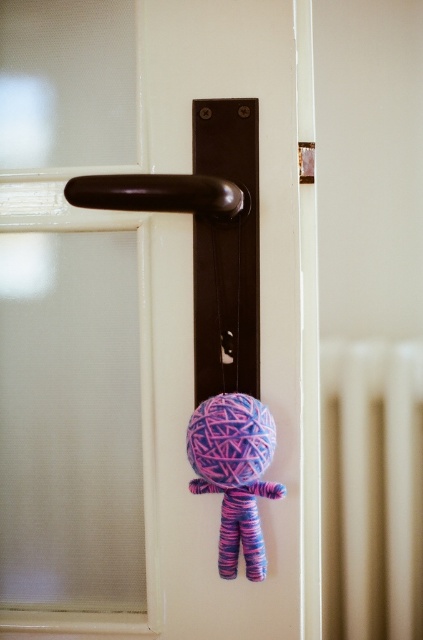
Which is in front, point (167, 60) or point (403, 621)?

Point (167, 60) is in front.

Measure the distance from matte brown handle at center to beige matte radiator at right.

matte brown handle at center is 19.74 inches away from beige matte radiator at right.

Between point (275, 72) and point (331, 529), which one is positioned behind?

Positioned behind is point (331, 529).

Image resolution: width=423 pixels, height=640 pixels. In order to click on matte brown handle at center in this screenshot , I will do `click(192, 316)`.

Identify the location of beige matte radiator at right. (370, 490).

What do you see at coordinates (370, 490) in the screenshot?
I see `beige matte radiator at right` at bounding box center [370, 490].

Who is more distant from viewer, (x=400, y=506) or (x=227, y=545)?

The point (x=400, y=506) is behind.

This screenshot has width=423, height=640. In order to click on beige matte radiator at right in this screenshot , I will do `click(370, 490)`.

Can you confirm if matte brown handle at center is smaller than knitted yarn doll at center?

Incorrect, matte brown handle at center is not smaller in size than knitted yarn doll at center.

Is matte brown handle at center thinner than knitted yarn doll at center?

No, matte brown handle at center is not thinner than knitted yarn doll at center.

What do you see at coordinates (192, 316) in the screenshot?
I see `matte brown handle at center` at bounding box center [192, 316].

This screenshot has width=423, height=640. In order to click on matte brown handle at center in this screenshot , I will do `click(192, 316)`.